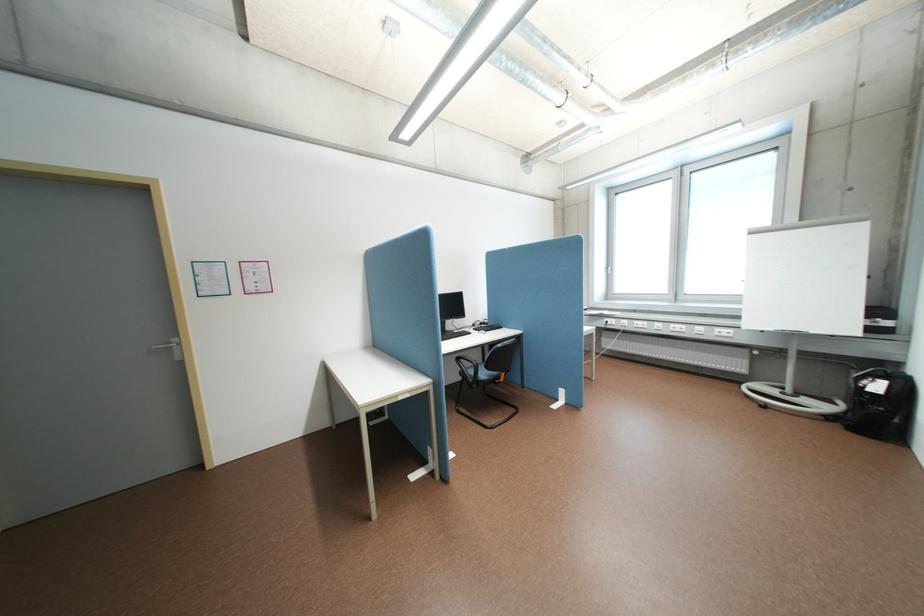
At what (x,y) coordinates should I click in order to perform the action: click on chair armrest. Please return your answer as a coordinate pair (x, y). The width and height of the screenshot is (924, 616). Looking at the image, I should click on (467, 371).